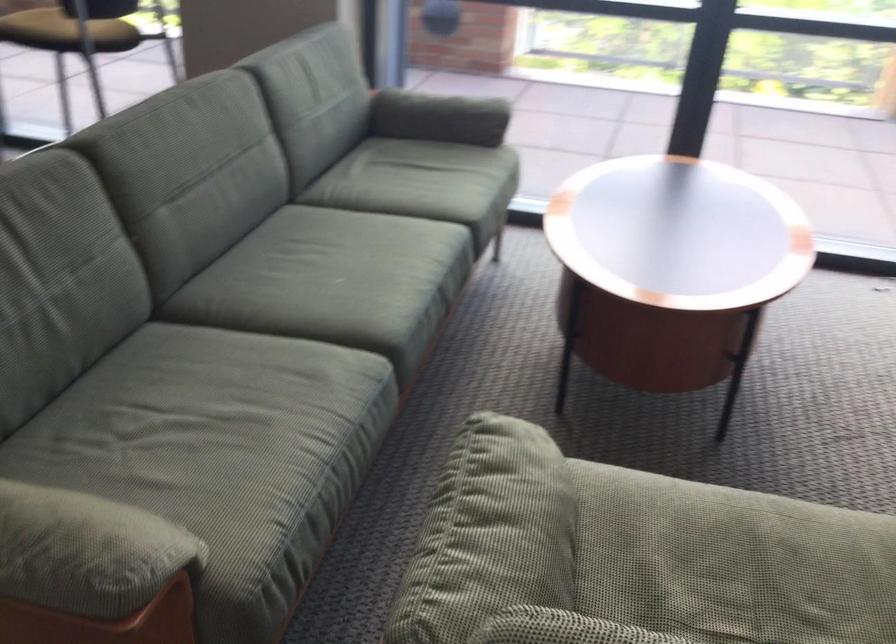
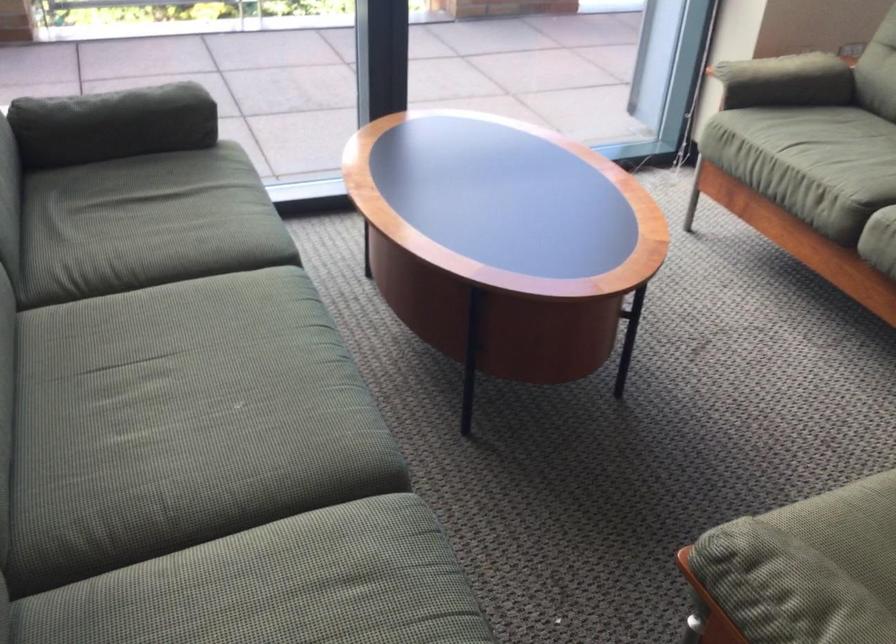
Locate, in the second image, the point that corresponds to pixel 297 289 in the first image.

(197, 446)